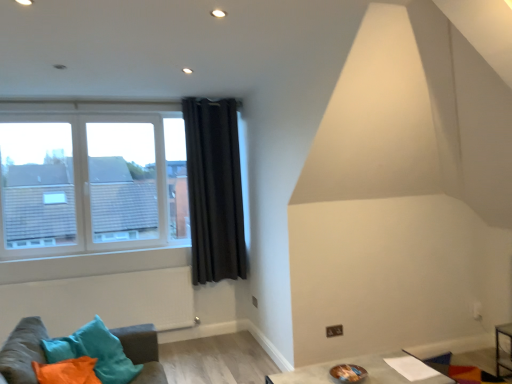
Question: Is the surface of clear glass window at left in direct contact with smooth gray table at lower center?

Choices:
 (A) no
 (B) yes

Answer: (A)

Question: Is clear glass window at left taller than smooth gray table at lower center?

Choices:
 (A) no
 (B) yes

Answer: (B)

Question: From a real-world perspective, is clear glass window at left positioned over smooth gray table at lower center based on gravity?

Choices:
 (A) yes
 (B) no

Answer: (A)

Question: From the image's perspective, would you say clear glass window at left is shown under smooth gray table at lower center?

Choices:
 (A) yes
 (B) no

Answer: (B)

Question: Is clear glass window at left aimed at smooth gray table at lower center?

Choices:
 (A) yes
 (B) no

Answer: (A)

Question: Visually, is black velvet curtain at upper center positioned to the left or to the right of velvet teal cushions at lower left?

Choices:
 (A) left
 (B) right

Answer: (B)

Question: From a real-world perspective, is black velvet curtain at upper center above or below velvet teal cushions at lower left?

Choices:
 (A) below
 (B) above

Answer: (B)

Question: Considering the positions of black velvet curtain at upper center and velvet teal cushions at lower left in the image, is black velvet curtain at upper center wider or thinner than velvet teal cushions at lower left?

Choices:
 (A) wide
 (B) thin

Answer: (B)

Question: From the image's perspective, is black velvet curtain at upper center located above or below velvet teal cushions at lower left?

Choices:
 (A) below
 (B) above

Answer: (B)

Question: Considering the positions of smooth gray table at lower center and black velvet curtain at upper center in the image, is smooth gray table at lower center wider or thinner than black velvet curtain at upper center?

Choices:
 (A) thin
 (B) wide

Answer: (B)

Question: Considering the positions of smooth gray table at lower center and black velvet curtain at upper center in the image, is smooth gray table at lower center taller or shorter than black velvet curtain at upper center?

Choices:
 (A) short
 (B) tall

Answer: (A)

Question: Considering the positions of point (401, 350) and point (205, 273), is point (401, 350) closer or farther from the camera than point (205, 273)?

Choices:
 (A) closer
 (B) farther

Answer: (A)

Question: From a real-world perspective, is smooth gray table at lower center above or below black velvet curtain at upper center?

Choices:
 (A) above
 (B) below

Answer: (B)

Question: From the image's perspective, is clear glass window at left located above or below velvet teal cushions at lower left?

Choices:
 (A) below
 (B) above

Answer: (B)

Question: Considering the positions of clear glass window at left and velvet teal cushions at lower left in the image, is clear glass window at left wider or thinner than velvet teal cushions at lower left?

Choices:
 (A) thin
 (B) wide

Answer: (A)